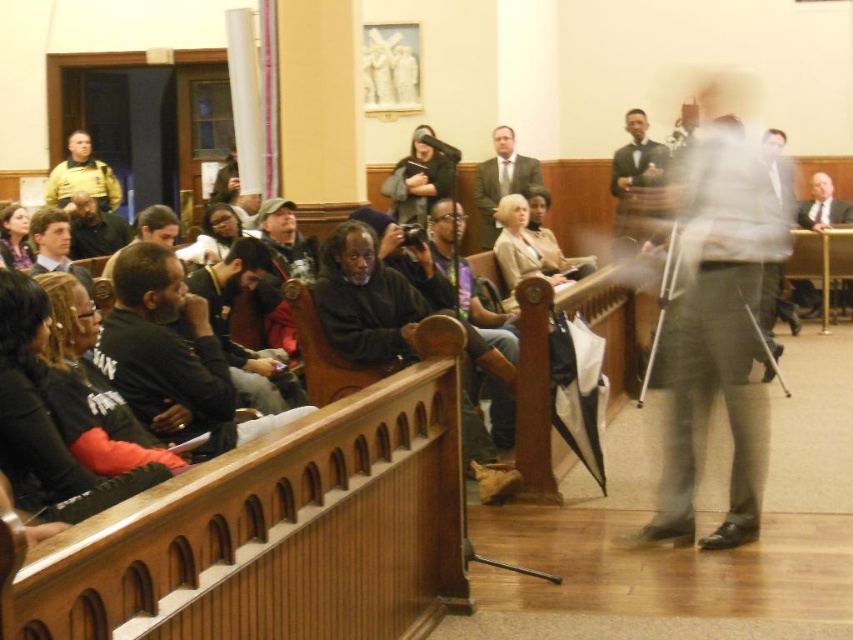
Question: Based on their relative distances, which object is farther from the dark gray hoodie at center?

Choices:
 (A) yellow uniform at left
 (B) matte gray suit at center

Answer: (A)

Question: From the image, what is the correct spatial relationship of dark gray hoodie at center in relation to yellow uniform at left?

Choices:
 (A) below
 (B) above

Answer: (B)

Question: Estimate the real-world distances between objects in this image. Which object is closer to the yellow uniform at left?

Choices:
 (A) matte gray suit at center
 (B) dark gray hoodie at center

Answer: (B)

Question: Is dark gray hoodie at center wider than yellow uniform at left?

Choices:
 (A) no
 (B) yes

Answer: (B)

Question: Can you confirm if dark gray hoodie at center is positioned to the right of yellow uniform at left?

Choices:
 (A) yes
 (B) no

Answer: (A)

Question: Which object is farther from the camera taking this photo?

Choices:
 (A) yellow uniform at left
 (B) dark gray hoodie at center

Answer: (B)